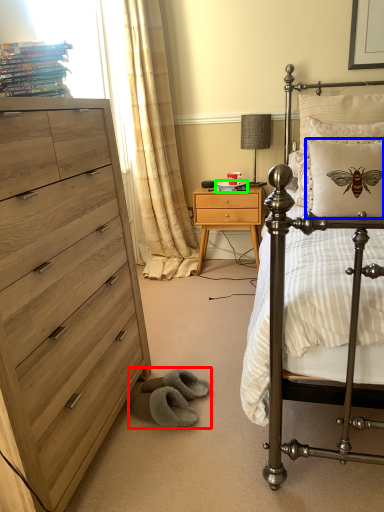
Question: Which object is positioned farthest from gray (highlighted by a red box)? Select from pillow (highlighted by a blue box) and magazine (highlighted by a green box).

Choices:
 (A) pillow
 (B) magazine

Answer: (B)